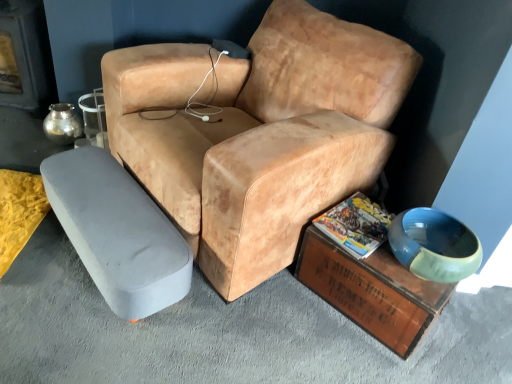
In order to click on vacant space situated above matte paper magazine at lower right (from a real-world perspective) in this screenshot , I will do [x=356, y=226].